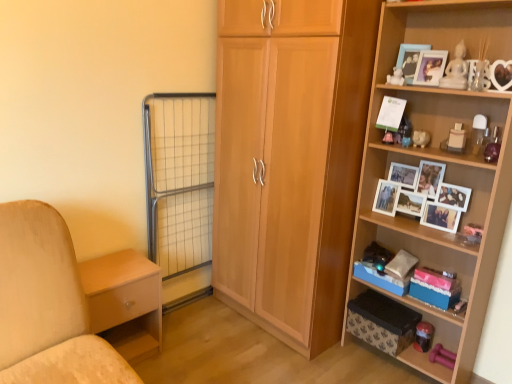
Measure the distance between point (371, 173) and camera.

Point (371, 173) is 2.14 meters away from camera.

Identify the location of white matte bear at upper right, acting as the second toy starting from the bottom. (396, 77).

Locate an element on the screen. Image resolution: width=512 pixels, height=384 pixels. white marble statue at upper right, which is counted as the 1th toy, starting from the right is located at coordinates (456, 70).

Is white wooden photo frames at upper right, the 2th shelf in the bottom-to-top sequence, at the back of white matte piggy bank at upper right, which is counted as the 1th toy, starting from the back?

No, white matte piggy bank at upper right, which is counted as the 1th toy, starting from the back, is not facing away from white wooden photo frames at upper right, the 2th shelf in the bottom-to-top sequence.

Which object is further away from the camera, white matte piggy bank at upper right, which is counted as the 1th toy, starting from the back, or white wooden photo frames at upper right, acting as the first shelf starting from the top?

white matte piggy bank at upper right, which is counted as the 1th toy, starting from the back, is further from the camera.

Looking at this image, would you consider white matte piggy bank at upper right, which ranks as the third toy in front-to-back order, to be distant from white wooden photo frames at upper right, acting as the first shelf starting from the top?

white matte piggy bank at upper right, which ranks as the third toy in front-to-back order, is near white wooden photo frames at upper right, acting as the first shelf starting from the top, not far away.

Can white wooden photo frames at upper right, the 2th shelf in the bottom-to-top sequence, be found inside white matte piggy bank at upper right, which is counted as the 1th toy, starting from the back?

No, white wooden photo frames at upper right, the 2th shelf in the bottom-to-top sequence, is not a part of white matte piggy bank at upper right, which is counted as the 1th toy, starting from the back.

This screenshot has width=512, height=384. In order to click on the 3rd storage box in front of the metal grid screen door at lower left in this screenshot , I will do `click(434, 288)`.

Is pink fabric storage box at lower right, the 2th storage box when ordered from top to bottom, completely or partially inside metal grid screen door at lower left?

No, pink fabric storage box at lower right, the 2th storage box when ordered from top to bottom, is located outside of metal grid screen door at lower left.

Does point (194, 128) come closer to viewer compared to point (441, 292)?

No, (194, 128) is behind (441, 292).

Between metal grid screen door at lower left and pink fabric storage box at lower right, the 2th storage box when ordered from top to bottom, which one appears on the left side from the viewer's perspective?

Positioned to the left is metal grid screen door at lower left.

This screenshot has width=512, height=384. Find the location of `cupboard above the white wooden photo frames at upper right, the 2th shelf in the bottom-to-top sequence (from the image's perspective)`. cupboard above the white wooden photo frames at upper right, the 2th shelf in the bottom-to-top sequence (from the image's perspective) is located at coordinates [x=290, y=161].

Relative to white wooden photo frames at upper right, the 2th shelf in the bottom-to-top sequence, is light brown wood cupboard at center in front or behind?

light brown wood cupboard at center is in front of white wooden photo frames at upper right, the 2th shelf in the bottom-to-top sequence.

Between light brown wood cupboard at center and white wooden photo frames at upper right, acting as the first shelf starting from the top, which one has smaller size?

white wooden photo frames at upper right, acting as the first shelf starting from the top.

Considering the sizes of objects white marble statue at upper right, which is counted as the 1th toy, starting from the right, and light wood/finely finished nightstand at lower left in the image provided, who is bigger, white marble statue at upper right, which is counted as the 1th toy, starting from the right, or light wood/finely finished nightstand at lower left?

light wood/finely finished nightstand at lower left is bigger.

Which object is wider, white marble statue at upper right, the first toy positioned from the front, or light wood/finely finished nightstand at lower left?

With larger width is light wood/finely finished nightstand at lower left.

Relative to light wood/finely finished nightstand at lower left, is white marble statue at upper right, the third toy when ordered from bottom to top, in front or behind?

white marble statue at upper right, the third toy when ordered from bottom to top, is positioned closer to the viewer than light wood/finely finished nightstand at lower left.

Looking at this image, would you say white marble statue at upper right, the first toy positioned from the front, is to the left or to the right of light wood/finely finished nightstand at lower left in the picture?

white marble statue at upper right, the first toy positioned from the front, is positioned on light wood/finely finished nightstand at lower left's right side.

Considering the relative sizes of white marble statue at upper right, positioned as the third toy in left-to-right order, and metal grid screen door at lower left in the image provided, is white marble statue at upper right, positioned as the third toy in left-to-right order, shorter than metal grid screen door at lower left?

Yes, white marble statue at upper right, positioned as the third toy in left-to-right order, is shorter than metal grid screen door at lower left.

Which object is positioned more to the left, white marble statue at upper right, arranged as the 3th toy when viewed from the back, or metal grid screen door at lower left?

Positioned to the left is metal grid screen door at lower left.

Can you tell me how much white marble statue at upper right, positioned as the third toy in left-to-right order, and metal grid screen door at lower left differ in facing direction?

90.4 degrees separate the facing orientations of white marble statue at upper right, positioned as the third toy in left-to-right order, and metal grid screen door at lower left.

From the picture: From the image's perspective, which is below, white marble statue at upper right, which is counted as the 1th toy, starting from the right, or metal grid screen door at lower left?

metal grid screen door at lower left appears lower in the image.

Based on the photo, is blue cardboard storage box at lower right, which appears as the 3th storage box when ordered from the bottom, placed right next to pink fabric storage box at lower right, which is the second storage box from bottom to top?

No.

Is blue cardboard storage box at lower right, which appears as the 3th storage box when ordered from the bottom, positioned with its back to pink fabric storage box at lower right, the 2th storage box when ordered from top to bottom?

blue cardboard storage box at lower right, which appears as the 3th storage box when ordered from the bottom, does not have its back to pink fabric storage box at lower right, the 2th storage box when ordered from top to bottom.

Could pink fabric storage box at lower right, the 2th storage box when ordered from top to bottom, be considered to be inside blue cardboard storage box at lower right, which appears as the 3th storage box when ordered from the bottom?

No, blue cardboard storage box at lower right, which appears as the 3th storage box when ordered from the bottom, does not contain pink fabric storage box at lower right, the 2th storage box when ordered from top to bottom.

Looking at the image, does blue cardboard storage box at lower right, which appears as the 3th storage box when ordered from the bottom, seem bigger or smaller compared to pink fabric storage box at lower right, which is the second storage box from bottom to top?

Clearly, blue cardboard storage box at lower right, which appears as the 3th storage box when ordered from the bottom, is larger in size than pink fabric storage box at lower right, which is the second storage box from bottom to top.

Consider the image. Considering the relative positions of white wooden photo frames at upper right, acting as the first shelf starting from the top, and metal grid screen door at lower left in the image provided, is white wooden photo frames at upper right, acting as the first shelf starting from the top, in front of metal grid screen door at lower left?

Yes.

From the picture: Are white wooden photo frames at upper right, acting as the first shelf starting from the top, and metal grid screen door at lower left far apart?

Absolutely, white wooden photo frames at upper right, acting as the first shelf starting from the top, is distant from metal grid screen door at lower left.

From the image's perspective, is white wooden photo frames at upper right, the 2th shelf in the bottom-to-top sequence, below metal grid screen door at lower left?

Incorrect, from the image's perspective, white wooden photo frames at upper right, the 2th shelf in the bottom-to-top sequence, is higher than metal grid screen door at lower left.

Measure the distance between white wooden photo frames at upper right, acting as the first shelf starting from the top, and metal grid screen door at lower left.

The distance of white wooden photo frames at upper right, acting as the first shelf starting from the top, from metal grid screen door at lower left is 3.46 feet.

This screenshot has width=512, height=384. I want to click on the 1st shelf located beneath the white matte piggy bank at upper right, which is counted as the 1th toy, starting from the back (from a real-world perspective), so click(410, 225).

At what (x,y) coordinates should I click in order to perform the action: click on screen door on the left of pink fabric storage box at lower right, which is the second storage box from bottom to top. Please return your answer as a coordinate pair (x, y). Looking at the image, I should click on (179, 179).

Estimate the real-world distances between objects in this image. Which object is further from white marble statue at upper right, the 1th toy from the top, wooden shelf at right, the second shelf in the top-to-bottom sequence, or light wood/finely finished nightstand at lower left?

light wood/finely finished nightstand at lower left is positioned further to the anchor white marble statue at upper right, the 1th toy from the top.

Consider the image. Which object lies nearer to the anchor point wooden shelf at right, the second shelf in the top-to-bottom sequence, blue cardboard storage box at lower right, the 1th storage box when ordered from top to bottom, or white matte piggy bank at upper right, which ranks as the third toy in front-to-back order?

white matte piggy bank at upper right, which ranks as the third toy in front-to-back order, lies closer to wooden shelf at right, the second shelf in the top-to-bottom sequence, than the other object.

From the picture: When comparing their distances from white matte bear at upper right, acting as the second toy starting from the front, does light brown wood cupboard at center or light wood/finely finished nightstand at lower left seem further?

light wood/finely finished nightstand at lower left lies further to white matte bear at upper right, acting as the second toy starting from the front, than the other object.

In the scene shown: From the image, which object appears to be nearer to wooden photo frame at upper right, the 1th picture frame when ordered from left to right, blue cardboard storage box at lower right, the 1th storage box when ordered from top to bottom, or white wooden photo frames at upper right, the 2th shelf in the bottom-to-top sequence?

Based on the image, white wooden photo frames at upper right, the 2th shelf in the bottom-to-top sequence, appears to be nearer to wooden photo frame at upper right, the 1th picture frame when ordered from left to right.

Based on their spatial positions, is patterned fabric storage box at lower right, the 3th storage box viewed from the top, or metal grid screen door at lower left further from wooden shelf at right, the second shelf in the top-to-bottom sequence?

metal grid screen door at lower left is positioned further to the anchor wooden shelf at right, the second shelf in the top-to-bottom sequence.

Based on their spatial positions, is pink fabric storage box at lower right, which is the second storage box from bottom to top, or blue cardboard storage box at lower right, the 1th storage box when ordered from top to bottom, further from metal grid screen door at lower left?

pink fabric storage box at lower right, which is the second storage box from bottom to top, is positioned further to the anchor metal grid screen door at lower left.

When comparing their distances from wooden shelf at right, the 1th shelf ordered from the bottom, does white wooden photo frames at upper right, acting as the first shelf starting from the top, or blue cardboard storage box at lower right, the 1th storage box when ordered from top to bottom, seem closer?

white wooden photo frames at upper right, acting as the first shelf starting from the top.

Considering their positions, is white matte piggy bank at upper right, which is counted as the 2th toy, starting from the right, positioned further to matte white photo frame at upper right, which is the second picture frame from left to right, than pink fabric storage box at lower right, the 2th storage box when ordered from top to bottom?

pink fabric storage box at lower right, the 2th storage box when ordered from top to bottom, is positioned further to the anchor matte white photo frame at upper right, which is the second picture frame from left to right.

Locate an element on the screen. Image resolution: width=512 pixels, height=384 pixels. picture frame between wooden photo frame at upper right, the 1th picture frame when ordered from left to right, and patterned fabric storage box at lower right, the 3th storage box viewed from the top, from top to bottom is located at coordinates (430, 67).

Find the location of a particular element. This screenshot has width=512, height=384. screen door situated between light wood/finely finished nightstand at lower left and white matte bear at upper right, placed as the 2th toy when sorted from back to front, from left to right is located at coordinates (179, 179).

The width and height of the screenshot is (512, 384). I want to click on cupboard between white marble statue at upper right, arranged as the 3th toy when viewed from the back, and pink fabric storage box at lower right, which is the second storage box from bottom to top, vertically, so click(290, 161).

Identify the location of storage box between white matte bear at upper right, acting as the second toy starting from the bottom, and pink fabric storage box at lower right, which is the second storage box from bottom to top, in the up-down direction. (381, 278).